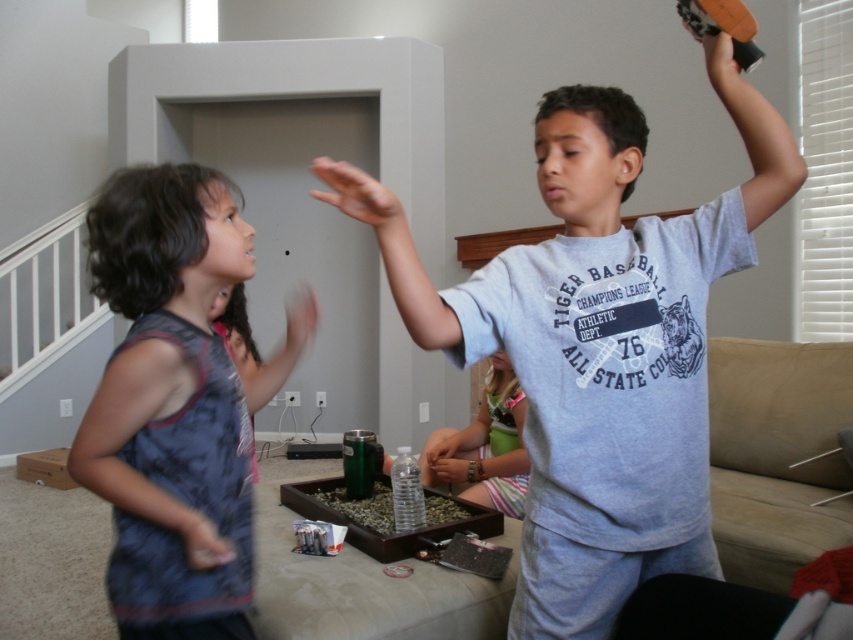
Question: Which of these objects is positioned farthest from the gray cotton shirt at center?

Choices:
 (A) dark blue sleeveless shirt at left
 (B) striped fabric pants at center

Answer: (B)

Question: Which object is the farthest from the striped fabric pants at center?

Choices:
 (A) gray cotton shirt at center
 (B) dark blue sleeveless shirt at left

Answer: (B)

Question: Can you confirm if gray cotton shirt at center is bigger than dark blue sleeveless shirt at left?

Choices:
 (A) no
 (B) yes

Answer: (B)

Question: Which point appears closest to the camera in this image?

Choices:
 (A) (x=494, y=406)
 (B) (x=248, y=259)

Answer: (B)

Question: Does gray cotton shirt at center appear over striped fabric pants at center?

Choices:
 (A) no
 (B) yes

Answer: (B)

Question: Can you confirm if gray cotton shirt at center is thinner than dark blue sleeveless shirt at left?

Choices:
 (A) no
 (B) yes

Answer: (A)